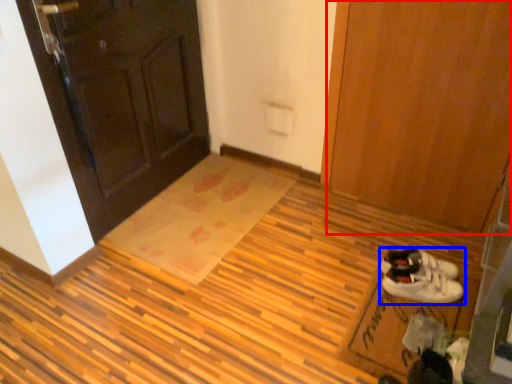
Question: Which object appears closest to the camera in this image, door (highlighted by a red box) or footwear (highlighted by a blue box)?

Choices:
 (A) door
 (B) footwear

Answer: (A)